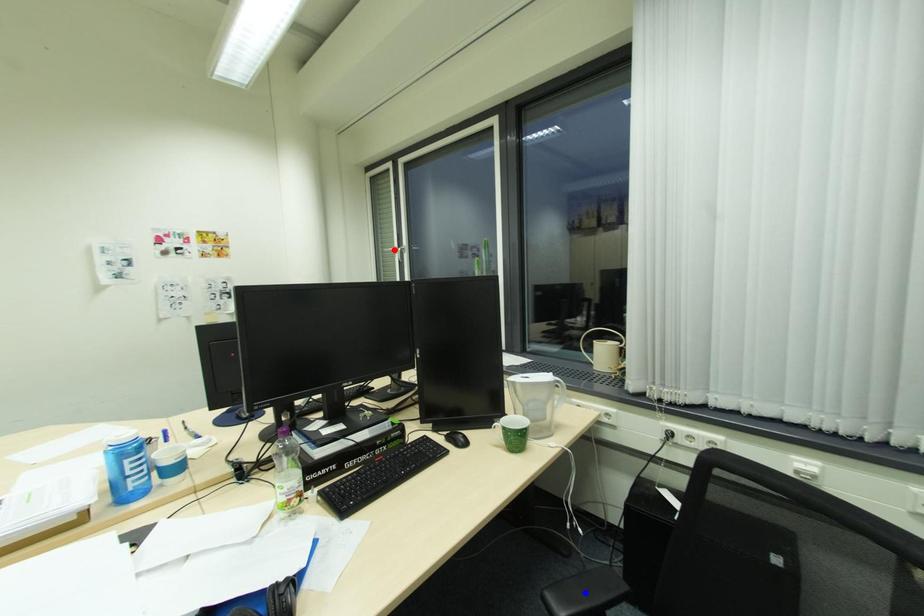
Question: Which of the two points in the image is closer to the camera?

Choices:
 (A) Blue point is closer.
 (B) Red point is closer.

Answer: (A)